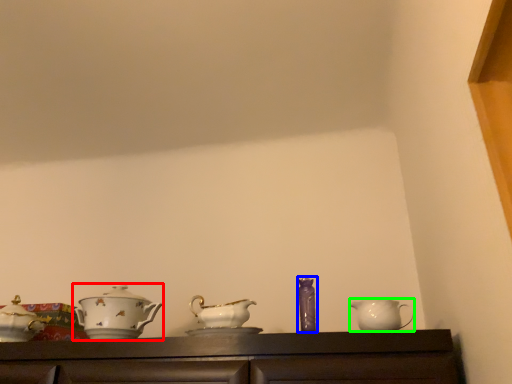
Question: Estimate the real-world distances between objects in this image. Which object is farther from tableware (highlighted by a red box), tableware (highlighted by a blue box) or jug (highlighted by a green box)?

Choices:
 (A) tableware
 (B) jug

Answer: (B)